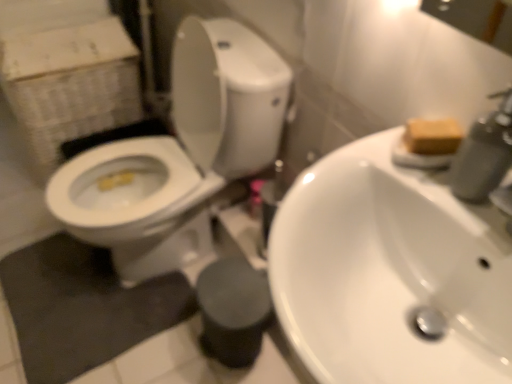
Question: Do you think white glossy sink at center is within white glossy toilet at left, or outside of it?

Choices:
 (A) inside
 (B) outside

Answer: (B)

Question: From the image's perspective, relative to white glossy toilet at left, is white glossy sink at center above or below?

Choices:
 (A) below
 (B) above

Answer: (A)

Question: Estimate the real-world distances between objects in this image. Which object is closer to the brown matte soap at upper right?

Choices:
 (A) white cardboard box at left
 (B) white glossy sink at center
 (C) black rubber bath mat at lower left
 (D) matte gray soap dispenser at upper right
 (E) white glossy toilet at left

Answer: (D)

Question: Which object is positioned closest to the brown matte soap at upper right?

Choices:
 (A) white glossy sink at center
 (B) white cardboard box at left
 (C) white glossy toilet at left
 (D) matte gray soap dispenser at upper right
 (E) black rubber bath mat at lower left

Answer: (D)